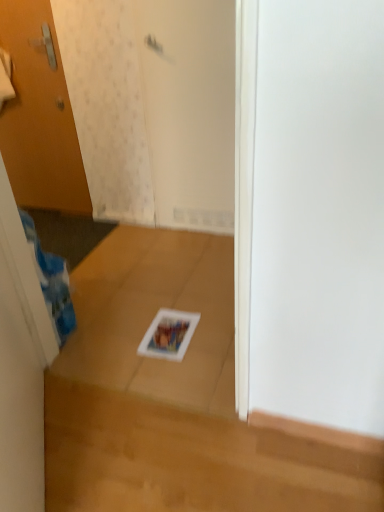
You are a GUI agent. You are given a task and a screenshot of the screen. Output one action in this format:
    pyautogui.click(x=<x>, y=<y>)
    Task: Click on the free location to the left of matte white magazine at center
    
    Given the screenshot: What is the action you would take?
    pyautogui.click(x=119, y=336)